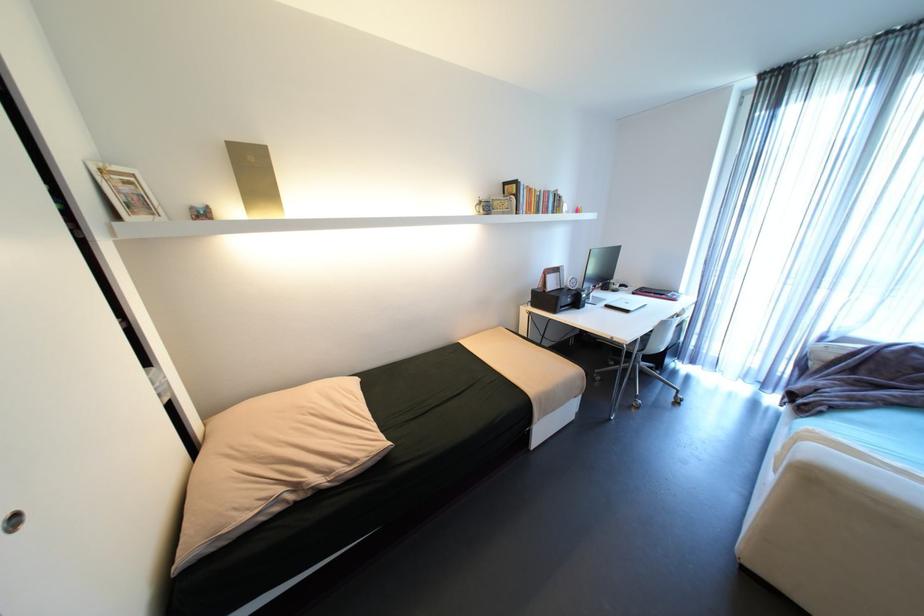
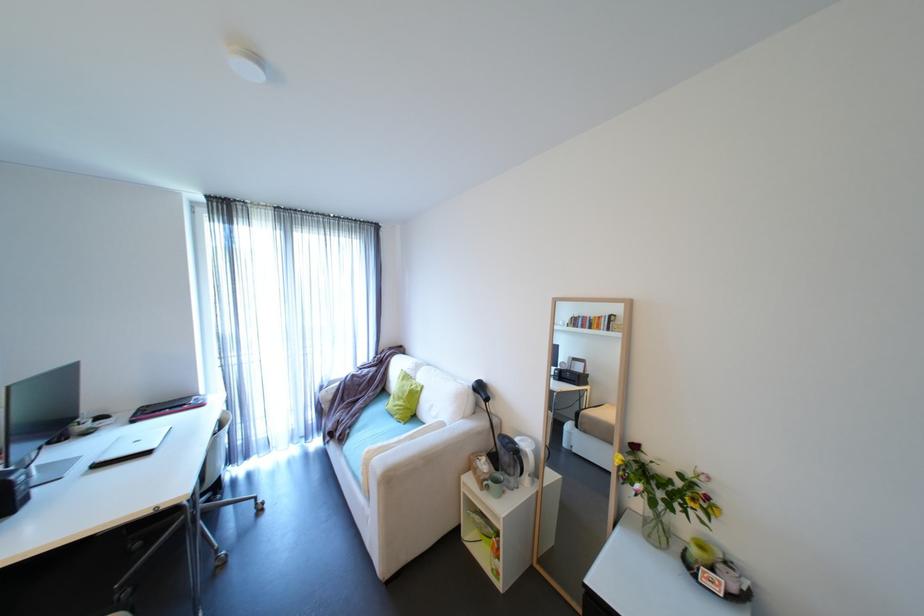
Locate, in the second image, the point that corresponds to point (722, 232) in the first image.

(225, 326)